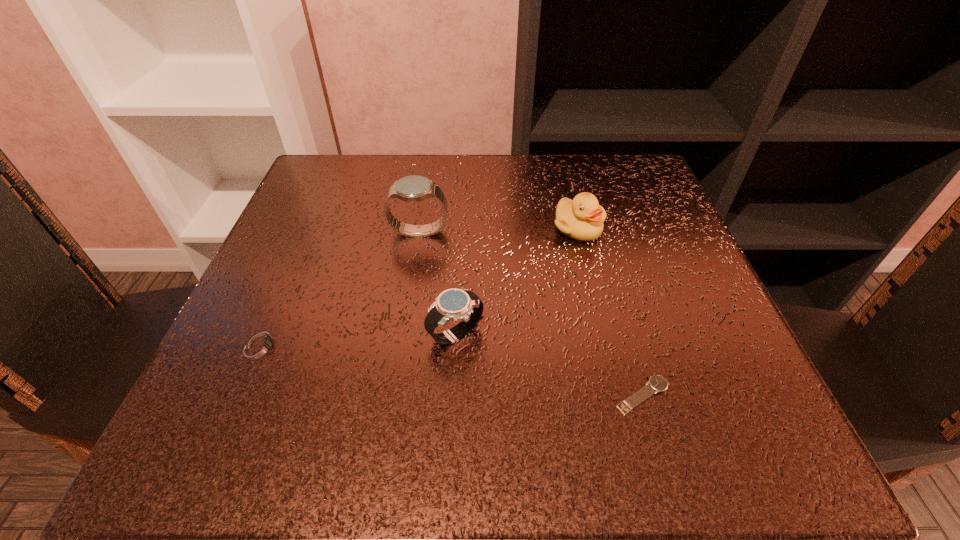
Where is `vacant space situated 0.360m on the back of the second tallest watch`? Image resolution: width=960 pixels, height=540 pixels. vacant space situated 0.360m on the back of the second tallest watch is located at coordinates (463, 190).

Locate an element on the screen. This screenshot has height=540, width=960. vacant space located 0.360m on the face of the leftmost object is located at coordinates (527, 346).

You are a GUI agent. You are given a task and a screenshot of the screen. Output one action in this format:
    pyautogui.click(x=<x>, y=<y>)
    Task: Click on the vacant point located on the right of the shortest object
    This screenshot has width=960, height=540.
    Given the screenshot: What is the action you would take?
    point(724,395)

Identify the location of object that is at the far edge. The width and height of the screenshot is (960, 540). (582, 218).

Locate an element on the screen. This screenshot has height=540, width=960. object located in the near edge section of the desktop is located at coordinates (657, 383).

This screenshot has height=540, width=960. What are the coordinates of `object at the left edge` in the screenshot? It's located at (262, 345).

Where is `duckling that is positioned at the right edge`? duckling that is positioned at the right edge is located at coordinates (582, 218).

Find the location of a particular element. This screenshot has width=960, height=540. watch located in the right edge section of the desktop is located at coordinates (657, 383).

Find the location of a particular element. object that is at the far right corner is located at coordinates (582, 218).

Where is `object that is at the near right corner`? The image size is (960, 540). object that is at the near right corner is located at coordinates (657, 383).